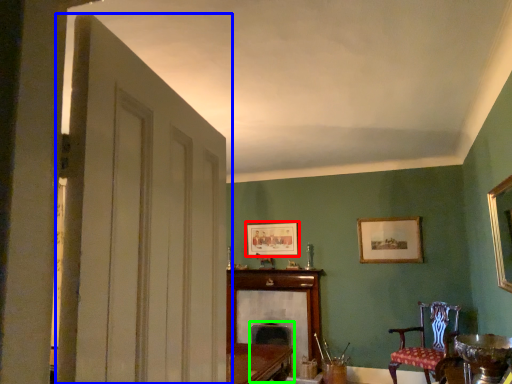
Question: Considering the real-world distances, which object is closest to picture frame (highlighted by a red box)? door (highlighted by a blue box) or swivel chair (highlighted by a green box).

Choices:
 (A) door
 (B) swivel chair

Answer: (B)